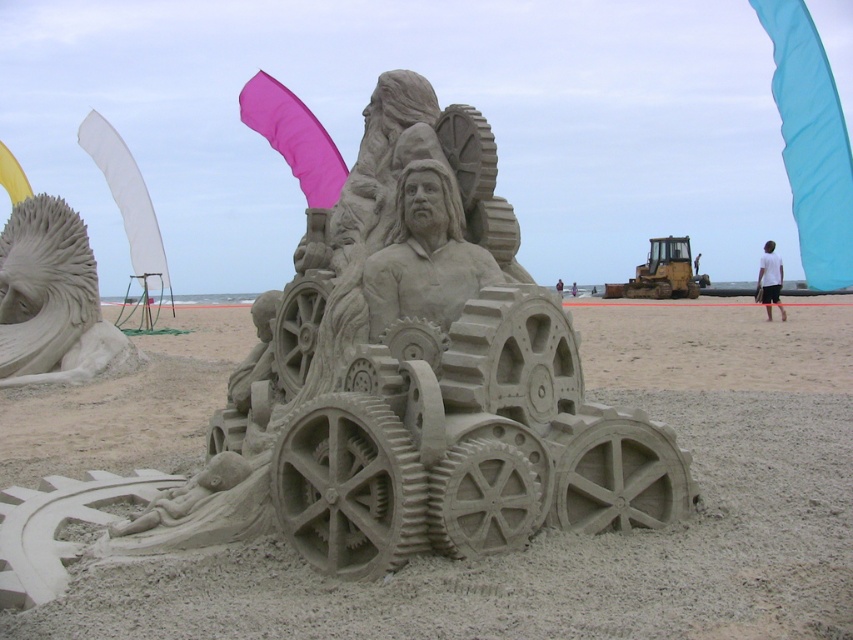
Which is behind, point (453, 390) or point (83, 339)?

Positioned behind is point (83, 339).

Which is in front, point (601, 515) or point (112, 340)?

Point (601, 515) is in front.

Who is more distant from viewer, [399,326] or [41,200]?

The point [41,200] is more distant.

This screenshot has width=853, height=640. Identify the location of sand sculpture at center. (413, 380).

Is sandstone gears at center to the left of sand sculpture at center from the viewer's perspective?

No, sandstone gears at center is not to the left of sand sculpture at center.

Between point (590, 630) and point (572, 394), which one is positioned behind?

Positioned behind is point (572, 394).

Identify the location of sandstone gears at center. The width and height of the screenshot is (853, 640). (581, 536).

Measure the distance between sandstone gears at center and smooth sand lion at left.

sandstone gears at center is 2.02 meters away from smooth sand lion at left.

Measure the distance between point (497, 625) and camera.

Point (497, 625) is 8.59 feet away from camera.

This screenshot has height=640, width=853. Describe the element at coordinates (581, 536) in the screenshot. I see `sandstone gears at center` at that location.

This screenshot has height=640, width=853. I want to click on sandstone gears at center, so click(581, 536).